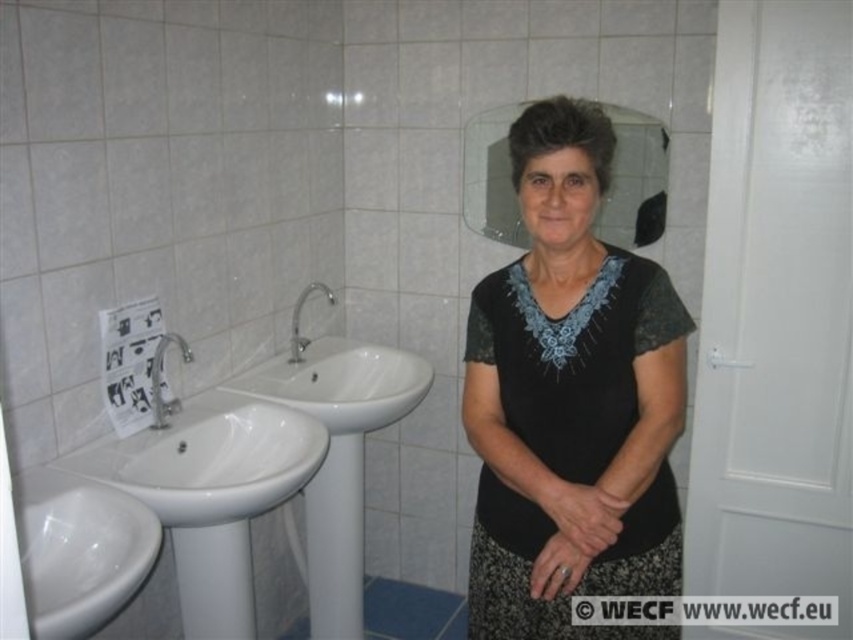
Who is taller, silver metallic faucet at left or silver metallic faucet at center?

With more height is silver metallic faucet at center.

Does silver metallic faucet at left appear over silver metallic faucet at center?

Incorrect, silver metallic faucet at left is not positioned above silver metallic faucet at center.

Image resolution: width=853 pixels, height=640 pixels. Find the location of `silver metallic faucet at left`. silver metallic faucet at left is located at coordinates (160, 378).

This screenshot has width=853, height=640. In order to click on silver metallic faucet at left in this screenshot , I will do `click(160, 378)`.

Between point (550, 394) and point (137, 449), which one is positioned behind?

The point (137, 449) is more distant.

The width and height of the screenshot is (853, 640). Describe the element at coordinates (573, 358) in the screenshot. I see `black lace dress at center` at that location.

Image resolution: width=853 pixels, height=640 pixels. I want to click on black lace dress at center, so click(573, 358).

Between black lace dress at center and silver metallic faucet at center, which one is positioned higher?

Positioned higher is silver metallic faucet at center.

Is black lace dress at center further to camera compared to silver metallic faucet at center?

No, black lace dress at center is closer to the viewer.

Locate an element on the screen. Image resolution: width=853 pixels, height=640 pixels. black lace dress at center is located at coordinates (573, 358).

Where is `black lace dress at center`? black lace dress at center is located at coordinates (573, 358).